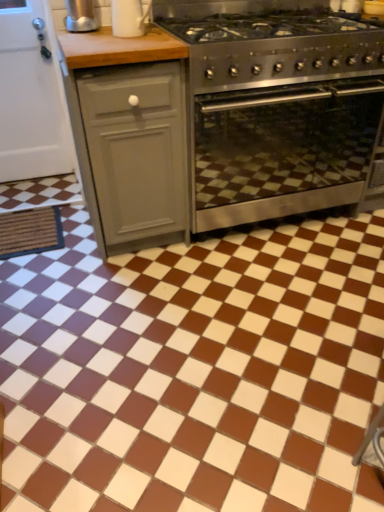
Question: Does satin silver kettle at upper left have a smaller size compared to brown glossy tile at center?

Choices:
 (A) no
 (B) yes

Answer: (B)

Question: Does satin silver kettle at upper left appear on the right side of brown glossy tile at center?

Choices:
 (A) no
 (B) yes

Answer: (A)

Question: Does satin silver kettle at upper left lie behind brown glossy tile at center?

Choices:
 (A) no
 (B) yes

Answer: (B)

Question: Is satin silver kettle at upper left wider than brown glossy tile at center?

Choices:
 (A) yes
 (B) no

Answer: (B)

Question: Is satin silver kettle at upper left taller than brown glossy tile at center?

Choices:
 (A) no
 (B) yes

Answer: (B)

Question: From the image's perspective, is stainless steel oven at center positioned above or below brown glossy tile at center?

Choices:
 (A) above
 (B) below

Answer: (A)

Question: Would you say stainless steel oven at center is to the left or to the right of brown glossy tile at center in the picture?

Choices:
 (A) right
 (B) left

Answer: (A)

Question: Is stainless steel oven at center wider or thinner than brown glossy tile at center?

Choices:
 (A) wide
 (B) thin

Answer: (B)

Question: Is stainless steel oven at center in front of or behind brown glossy tile at center in the image?

Choices:
 (A) front
 (B) behind

Answer: (B)

Question: Looking at the image, does satin silver kettle at upper left seem bigger or smaller compared to stainless steel oven at center?

Choices:
 (A) small
 (B) big

Answer: (A)

Question: Is satin silver kettle at upper left taller or shorter than stainless steel oven at center?

Choices:
 (A) tall
 (B) short

Answer: (B)

Question: Looking at their shapes, would you say satin silver kettle at upper left is wider or thinner than stainless steel oven at center?

Choices:
 (A) thin
 (B) wide

Answer: (A)

Question: From a real-world perspective, is satin silver kettle at upper left positioned above or below stainless steel oven at center?

Choices:
 (A) below
 (B) above

Answer: (B)

Question: Is stainless steel gas stove at center inside or outside of white glossy mug at upper center?

Choices:
 (A) inside
 (B) outside

Answer: (B)

Question: In terms of height, does stainless steel gas stove at center look taller or shorter compared to white glossy mug at upper center?

Choices:
 (A) tall
 (B) short

Answer: (A)